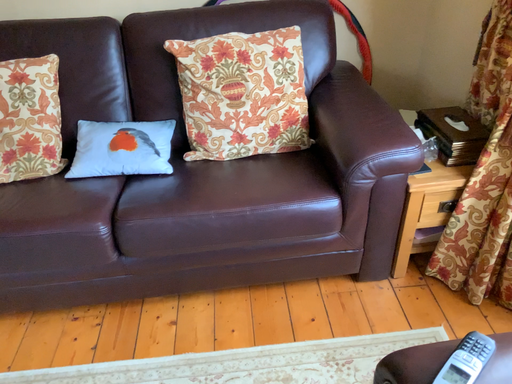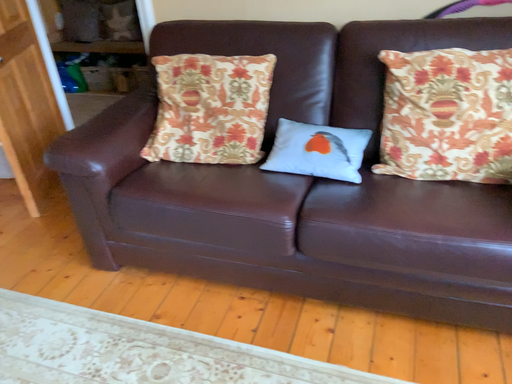
Question: How did the camera likely rotate when shooting the video?

Choices:
 (A) rotated right
 (B) rotated left

Answer: (B)